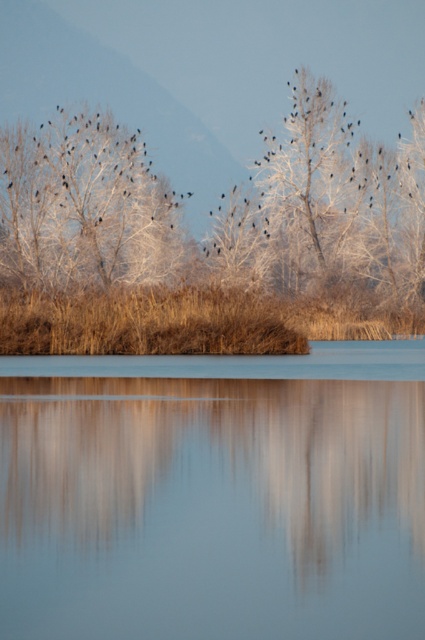
You are an ornithologist observing the scene. You notice the smooth glass water at center and the white frosty tree at upper left. Which object is positioned to the right of the other?

The smooth glass water at center is to the right of the white frosty tree at upper left.